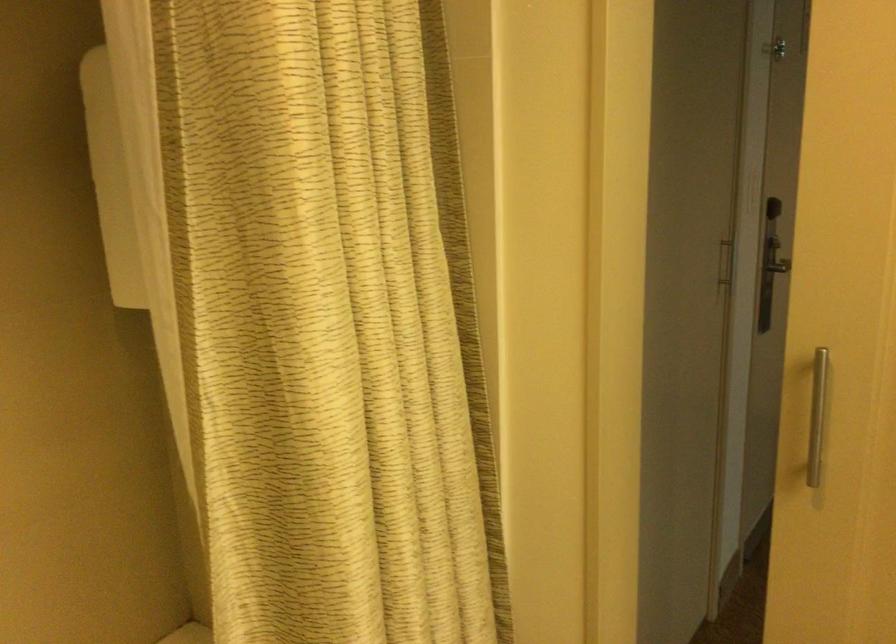
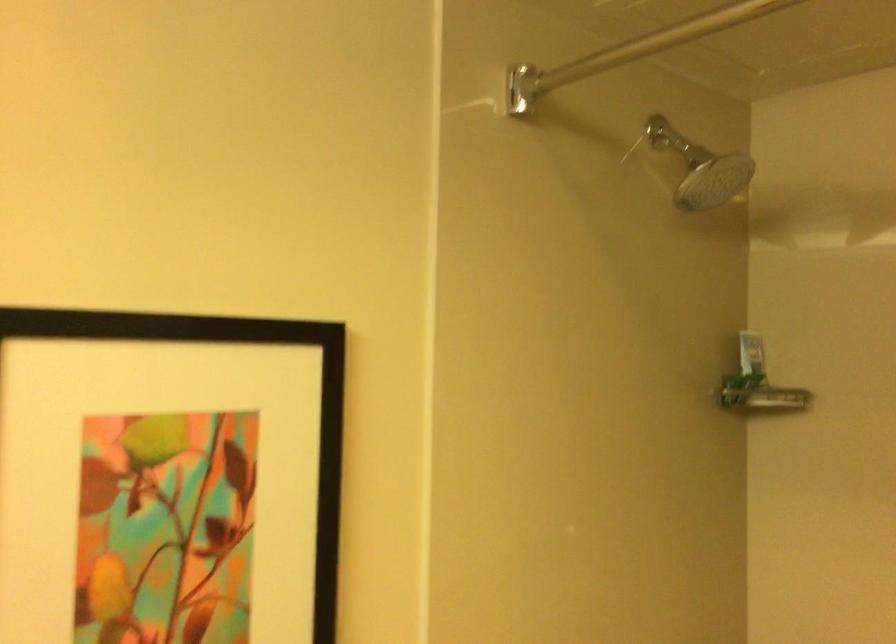
Question: How did the camera likely rotate?

Choices:
 (A) Left
 (B) Right
 (C) Up
 (D) Down

Answer: (A)